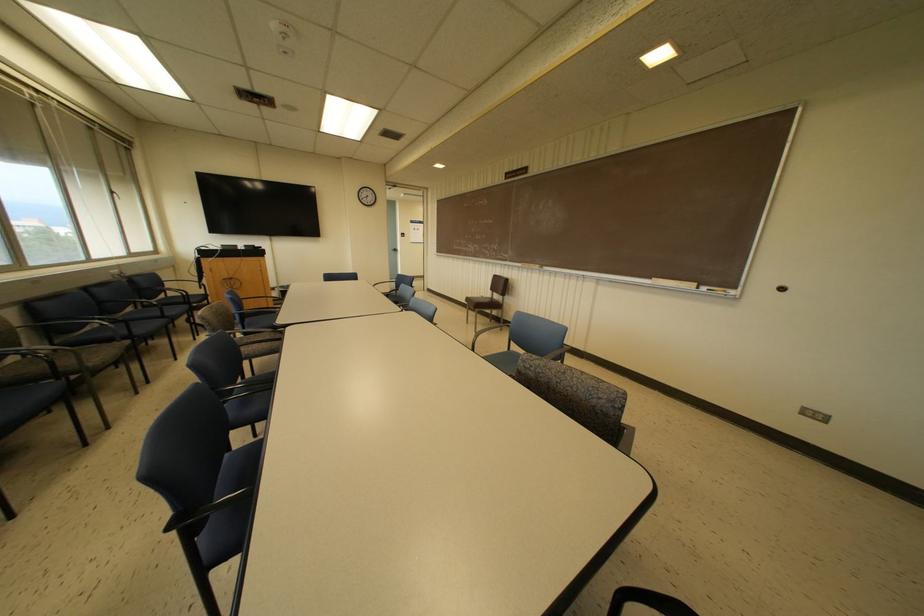
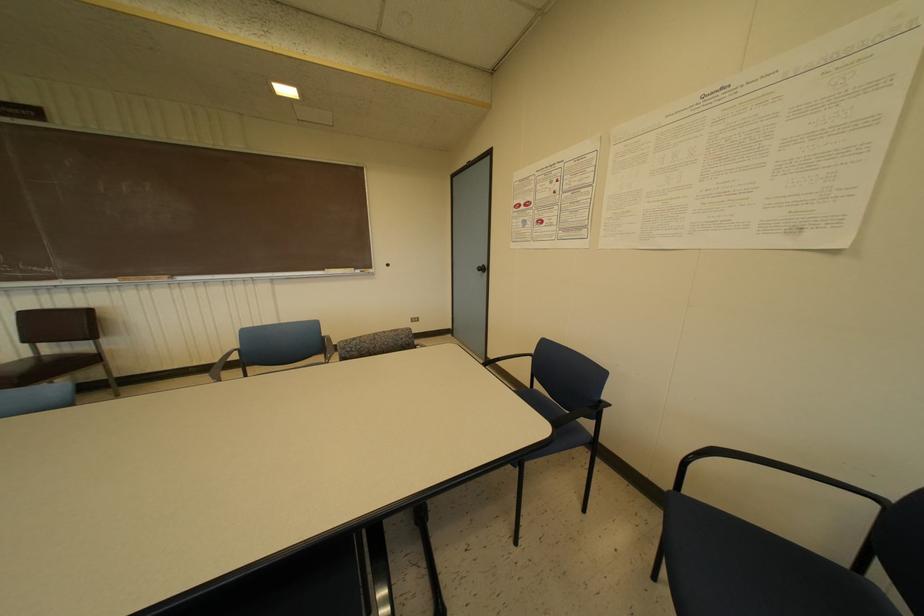
Question: How did the camera likely rotate?

Choices:
 (A) Left
 (B) Right
 (C) Up
 (D) Down

Answer: (B)